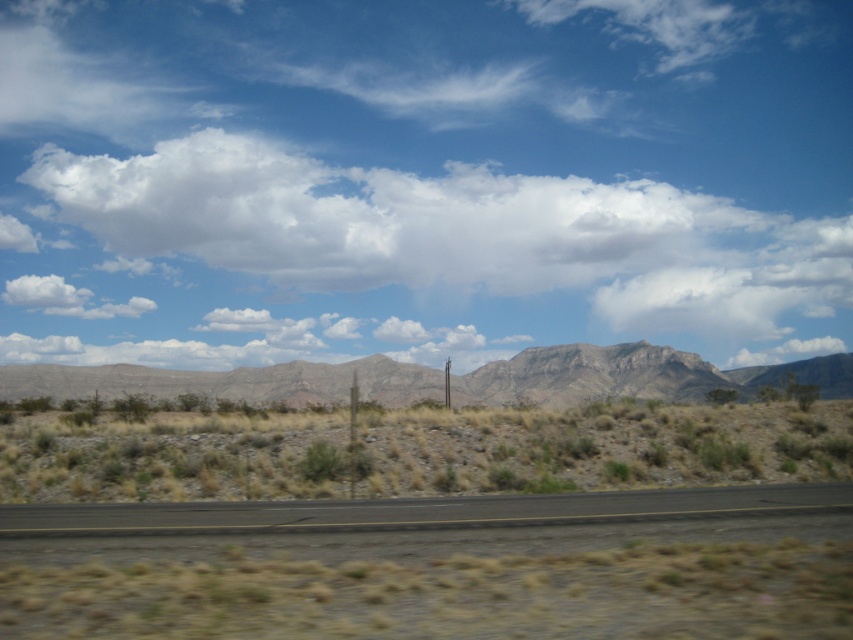
Which of these two, white fluffy cloud at upper center or rugged stone mountain at center, stands taller?

white fluffy cloud at upper center

Does white fluffy cloud at upper center appear over rugged stone mountain at center?

Indeed, white fluffy cloud at upper center is positioned over rugged stone mountain at center.

Find the location of a particular element. This screenshot has width=853, height=640. white fluffy cloud at upper center is located at coordinates (392, 259).

Identify the location of white fluffy cloud at upper center. This screenshot has height=640, width=853. (392, 259).

Is point (579, 390) closer to viewer compared to point (352, 500)?

No, (579, 390) is behind (352, 500).

Which is behind, point (612, 392) or point (16, 531)?

Positioned behind is point (612, 392).

The width and height of the screenshot is (853, 640). Identify the location of rugged stone mountain at center. (631, 376).

Does white fluffy cloud at upper center have a lesser height compared to brown/dry grass at center?

In fact, white fluffy cloud at upper center may be taller than brown/dry grass at center.

Is point (109, 202) less distant than point (88, 448)?

No, it is not.

Identify the location of white fluffy cloud at upper center. The image size is (853, 640). (392, 259).